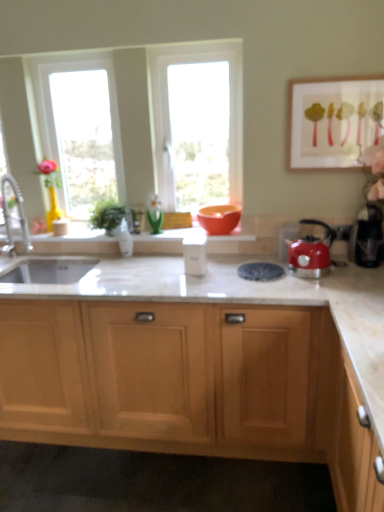
Find the location of a particular element. The height and width of the screenshot is (512, 384). free space in front of clear glass vase at center, which is the 2th glass vase from right to left is located at coordinates (130, 266).